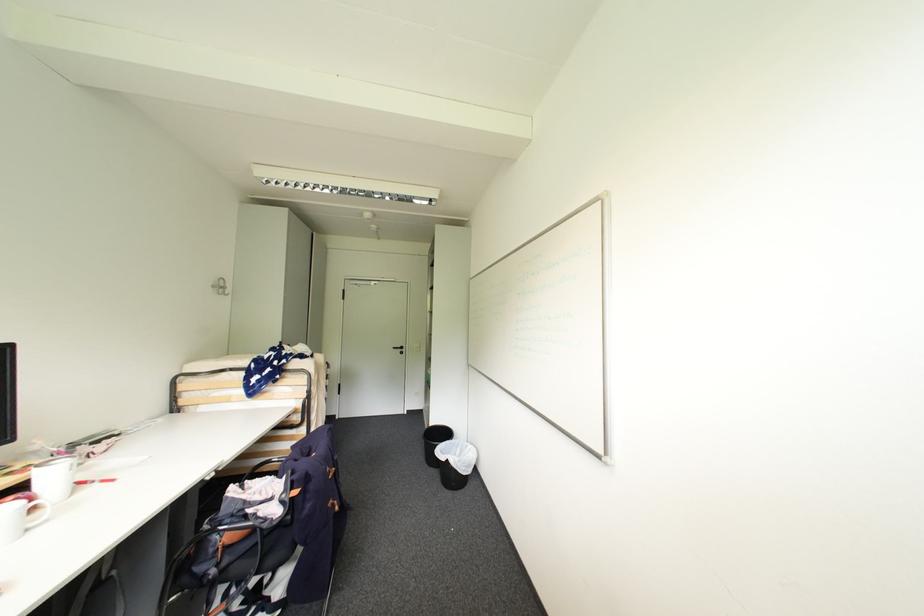
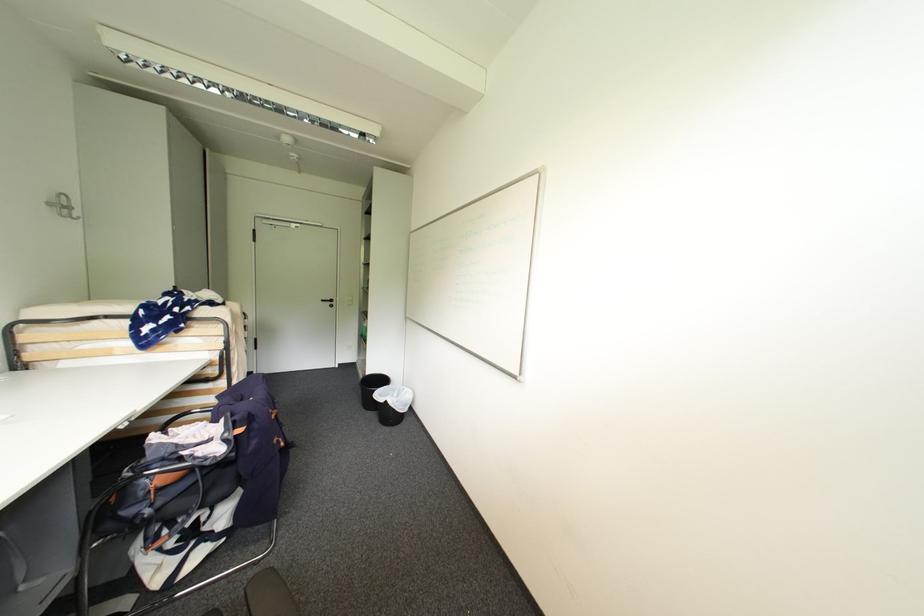
What movement of the cameraman would produce the second image?

The movement direction of the cameraman is left, backward.